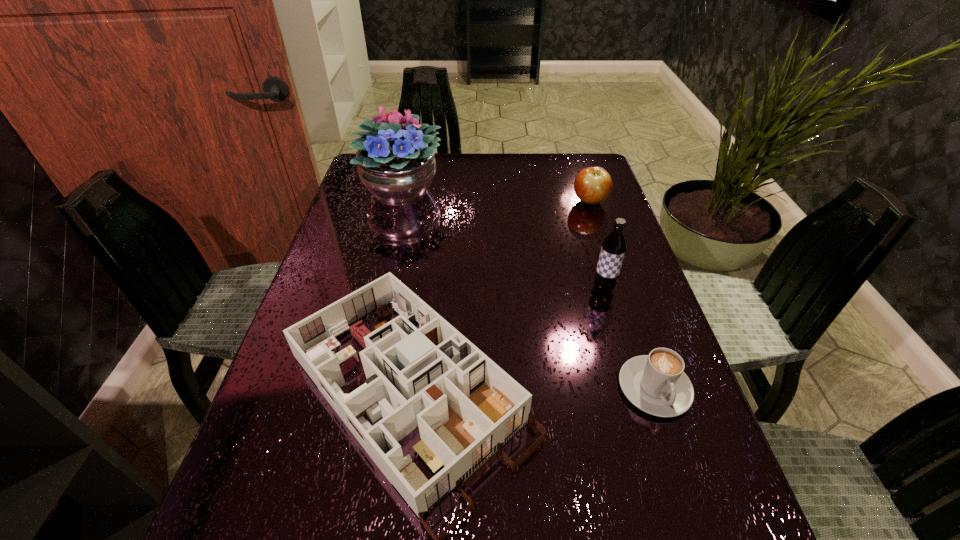
Locate an element on the screen. the tallest object is located at coordinates (396, 162).

You are a GUI agent. You are given a task and a screenshot of the screen. Output one action in this format:
    pyautogui.click(x=<x>, y=<y>)
    Task: Click on the second tallest object
    The image size is (960, 540).
    Given the screenshot: What is the action you would take?
    point(613,249)

Find the location of a particular element. The height and width of the screenshot is (540, 960). root beer is located at coordinates (613, 249).

I want to click on apple, so click(592, 185).

Image resolution: width=960 pixels, height=540 pixels. In order to click on cappuccino in this screenshot , I will do `click(656, 383)`.

Identify the location of free space located on the right of the tallest object. (487, 190).

In order to click on free space located 0.310m on the back of the second tallest object in this screenshot , I will do `click(580, 207)`.

You are a GUI agent. You are given a task and a screenshot of the screen. Output one action in this format:
    pyautogui.click(x=<x>, y=<y>)
    Task: Click on the free space located 0.060m on the front of the apple
    The image size is (960, 540).
    Given the screenshot: What is the action you would take?
    pyautogui.click(x=597, y=224)

Identify the location of free spot located 0.070m to the right of the cappuccino. The image size is (960, 540). (678, 459).

You are a GUI agent. You are given a task and a screenshot of the screen. Output one action in this format:
    pyautogui.click(x=<x>, y=<y>)
    Task: Click on the object that is at the far edge
    
    Given the screenshot: What is the action you would take?
    pyautogui.click(x=396, y=162)